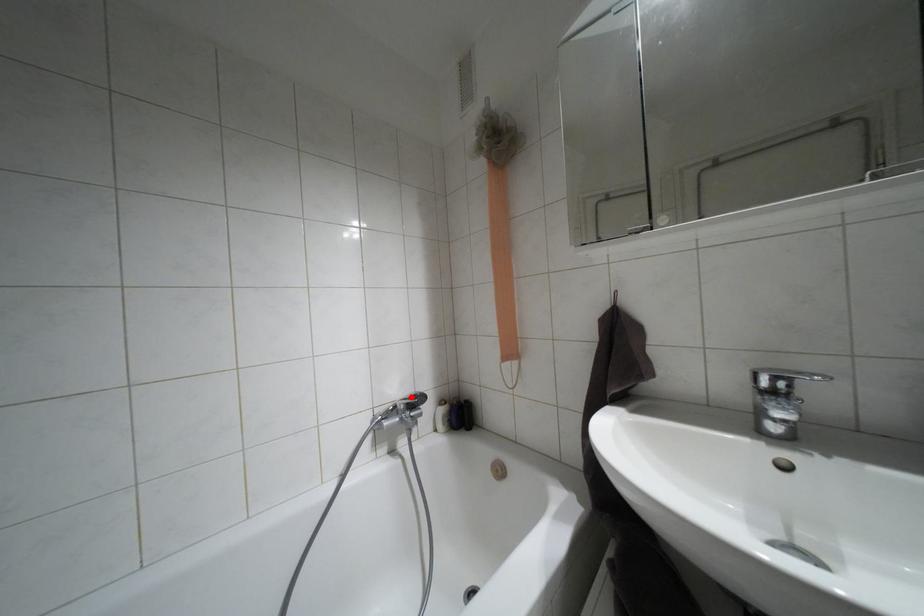
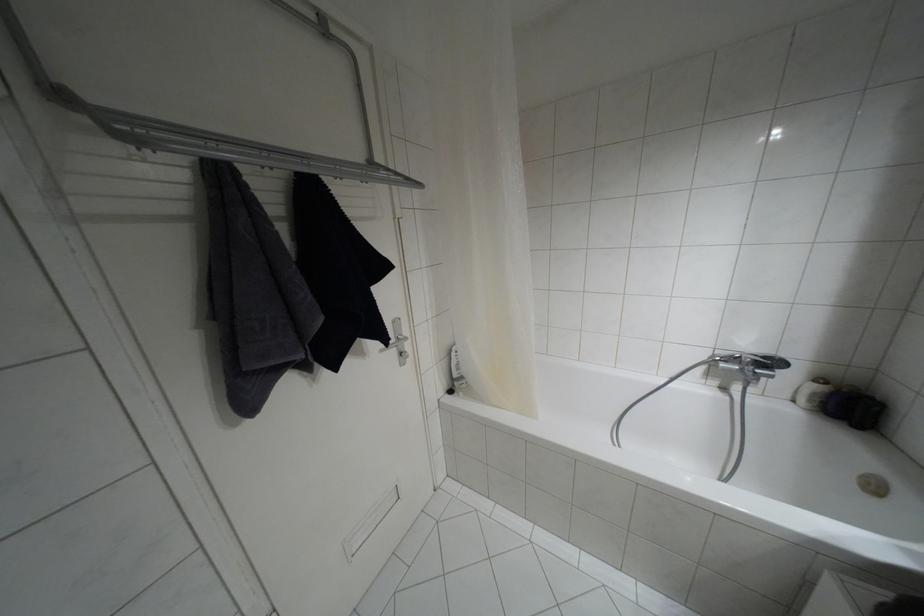
Locate, in the second image, the point that corresponds to the highlighted location in the first image.

(763, 357)